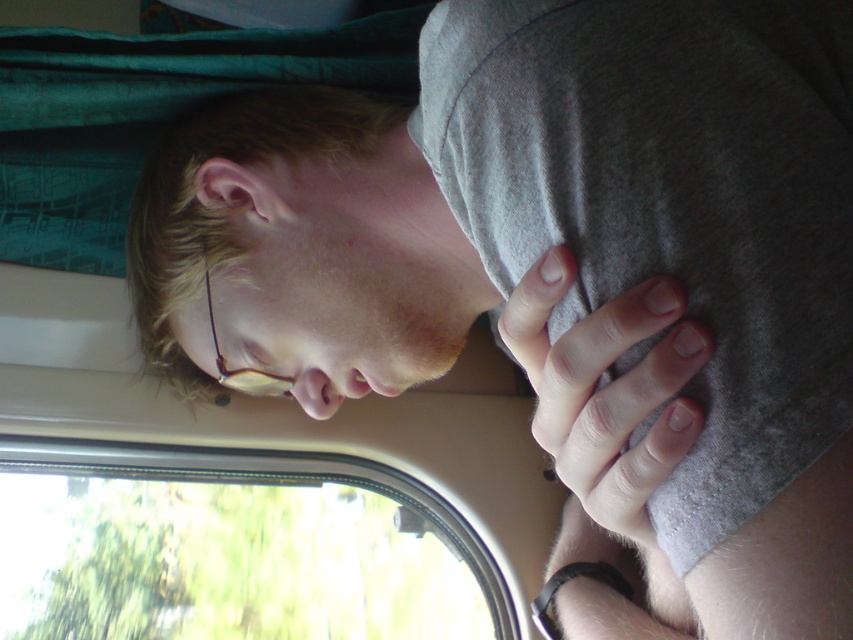
You are a photographer trying to capture a closeup of the person in the vehicle. The matte gray hair at upper center and the pink smooth nose at center are important features. Can you fit both features into a frame that can only accommodate objects within a 10 cm width? Explain your answer.

The matte gray hair at upper center and pink smooth nose at center are 12.47 centimeters apart. Since the required frame width is 10 cm, which is smaller than the distance between them, both features cannot fit into the frame simultaneously.

You are inside a moving vehicle and need to place a small object on the seat in front of you. There are two points marked on the seat where you can place it. The first point is at coordinates point (618, 296) and the second is at point (340, 397). Which point is closer to you?

Point (618, 296) is in front of point (340, 397), so placing the object at point (340, 397) would be closer to you.

You are a passenger on a moving vehicle and want to look outside through the transparent glass window at lower left while keeping your eyes on the pink smooth nose at center. Is the window positioned in a way that allows you to see outside without moving your head?

The transparent glass window at lower left is located below the pink smooth nose at center, so you can look down towards the window while keeping your eyes on the pink smooth nose at center without moving your head.